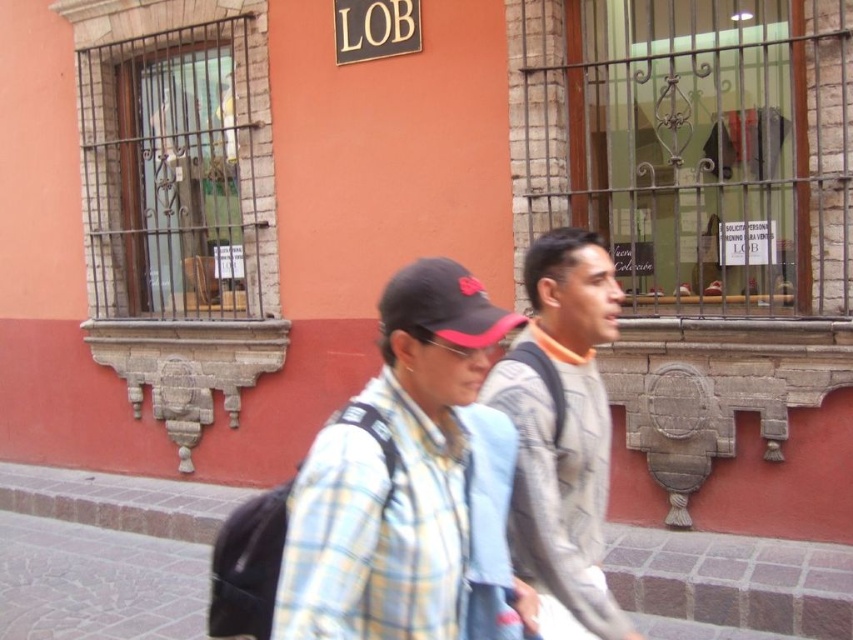
You are a fashion designer observing the scene. You notice the plaid fabric shirt at center and the brick pavement at center. Which object is bigger in size?

The plaid fabric shirt at center is larger in size than the brick pavement at center.

You are standing at the center of the image and see the gray textured sweater at center and the brick pavement at center. Which object is located to the right of the other?

The gray textured sweater at center is positioned on the right side of brick pavement at center.